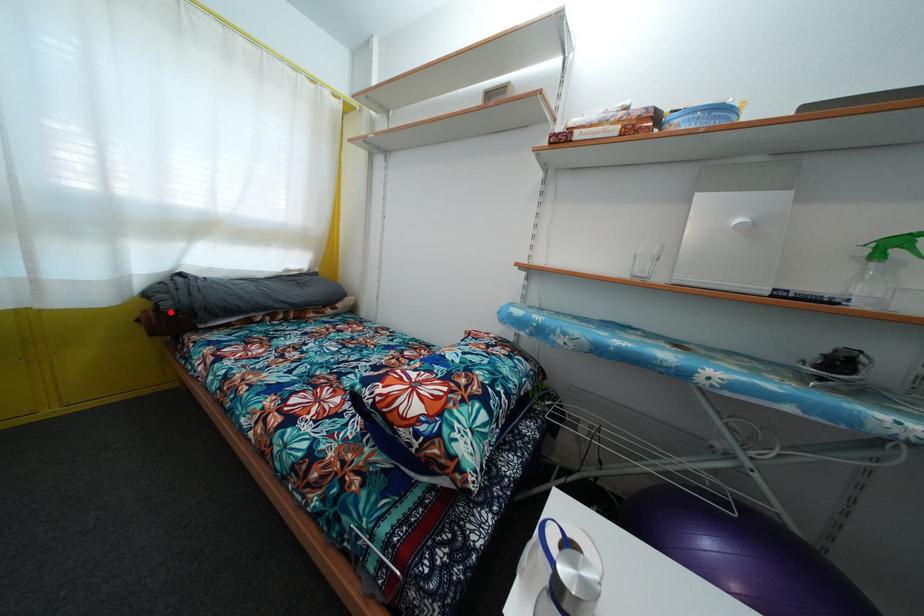
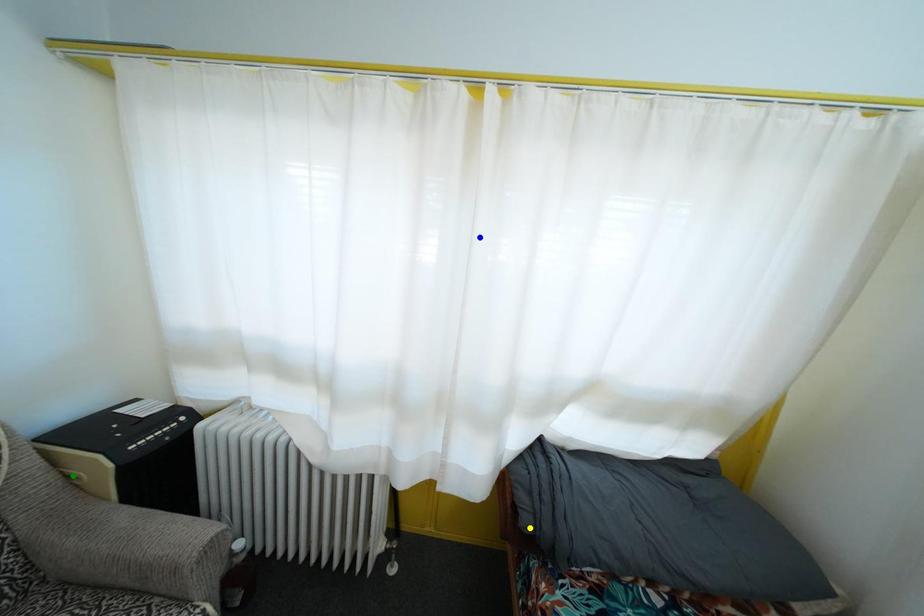
Question: I am providing you with two images of the same scene from different viewpoints. A red point is marked on the first image. You are given multiple points on the second image. In image 2, which mark is for the same physical point as the one in image 1?

Choices:
 (A) blue point
 (B) yellow point
 (C) green point

Answer: (B)